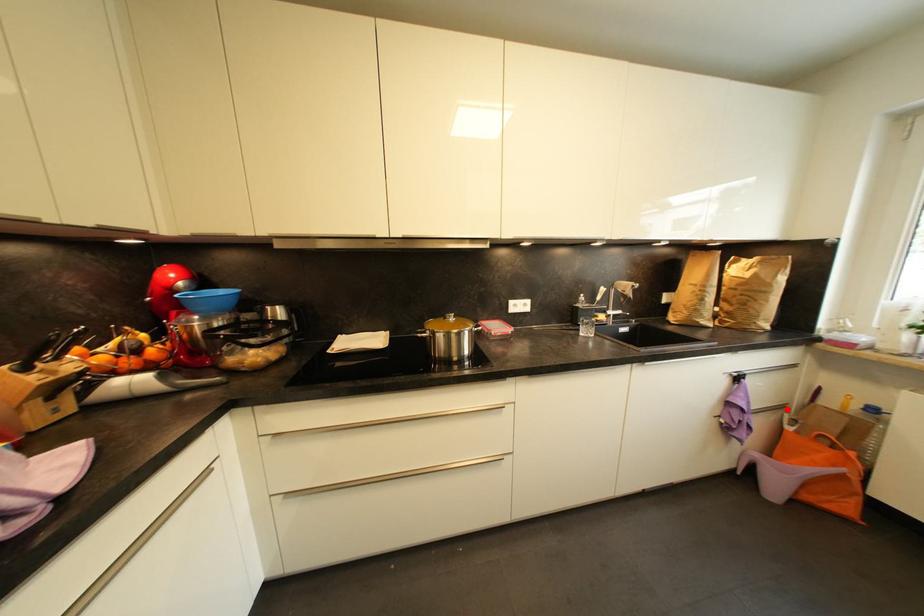
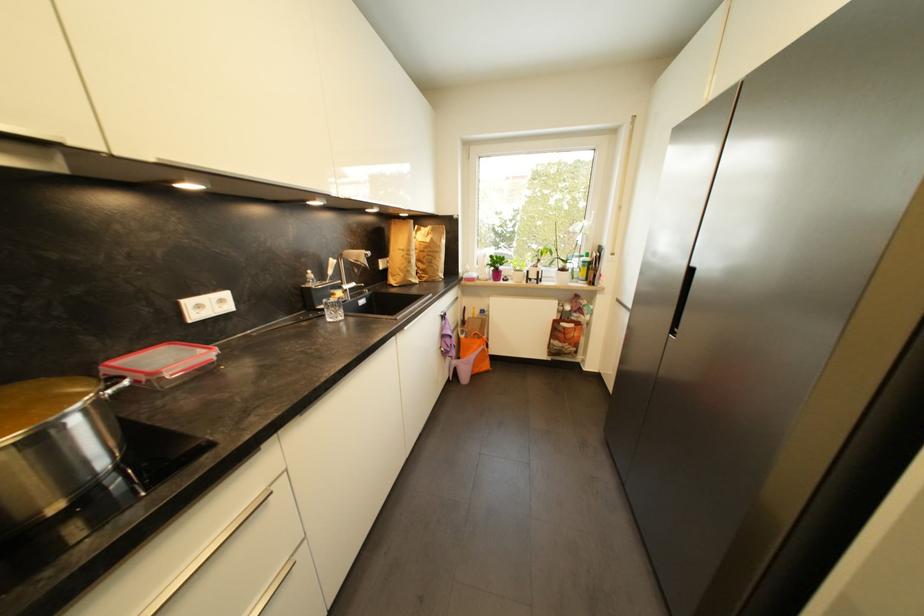
Locate, in the second image, the point that corresponds to the highlighted location in the first image.

(463, 328)